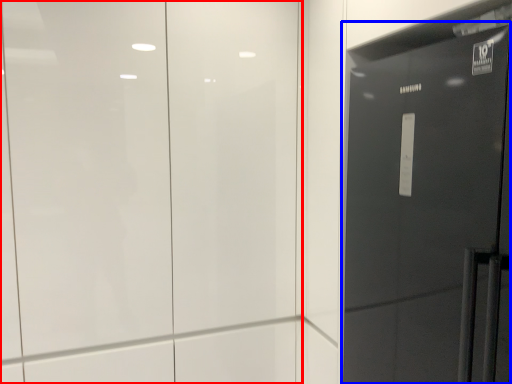
Question: Which point is further to the camera, door (highlighted by a red box) or door (highlighted by a blue box)?

Choices:
 (A) door
 (B) door

Answer: (A)